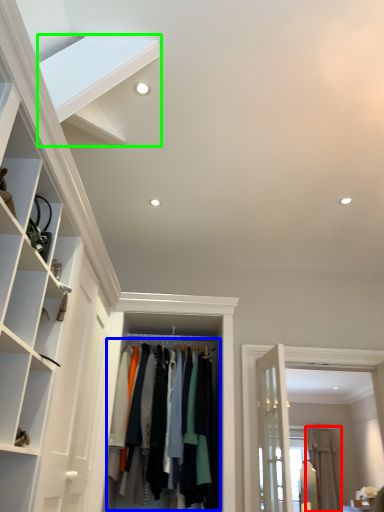
Question: Which is nearer to the curtain (highlighted by a red box)? clothing (highlighted by a blue box) or stairs (highlighted by a green box).

Choices:
 (A) clothing
 (B) stairs

Answer: (A)